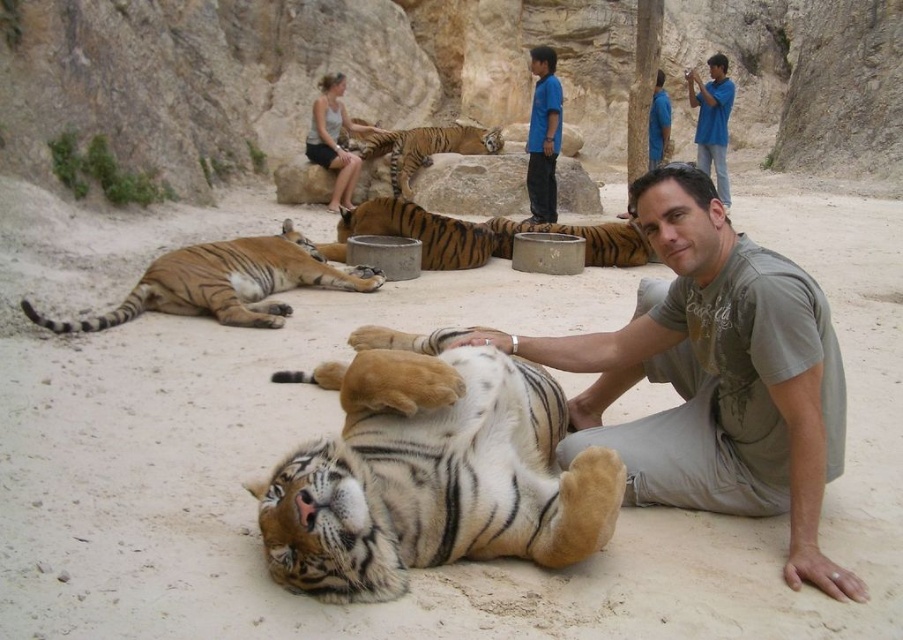
Question: Can you confirm if white-striped fur tiger at center is wider than orange fur tiger at upper center?

Choices:
 (A) yes
 (B) no

Answer: (B)

Question: Can you confirm if white-striped fur tiger at center is thinner than orange-brown fur tiger at center?

Choices:
 (A) no
 (B) yes

Answer: (B)

Question: Estimate the real-world distances between objects in this image. Which object is farther from the blue cotton shirt at upper center?

Choices:
 (A) white-striped fur tiger at center
 (B) matte gray t-shirt at center

Answer: (A)

Question: Which is farther from the blue cotton shirt at upper center?

Choices:
 (A) orange-brown fur tiger at center
 (B) orange fur tiger at center
 (C) orange fur tiger at upper center

Answer: (B)

Question: Which object appears closest to the camera in this image?

Choices:
 (A) orange fur tiger at center
 (B) blue cotton shirt at upper center

Answer: (A)

Question: Is orange fur tiger at center behind orange fur tiger at upper center?

Choices:
 (A) no
 (B) yes

Answer: (A)